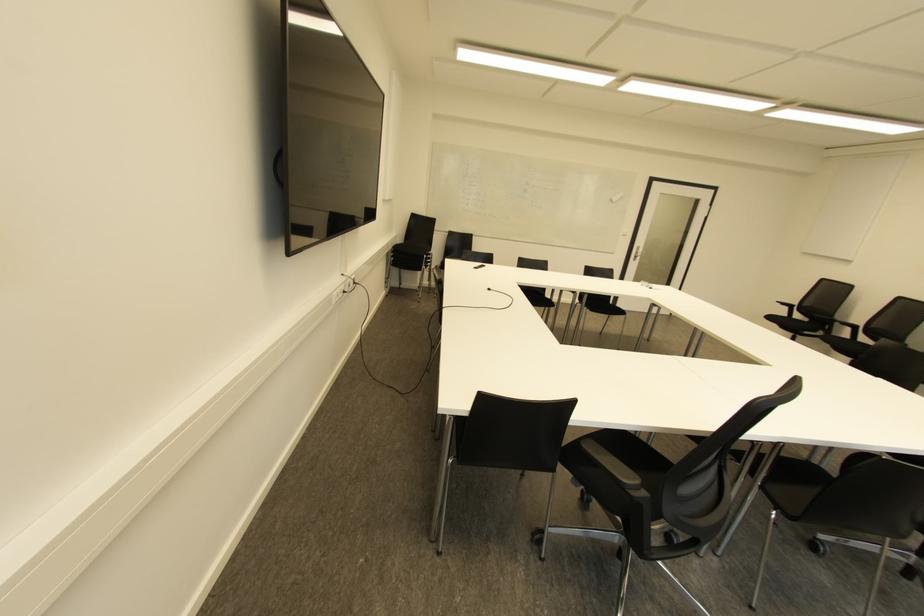
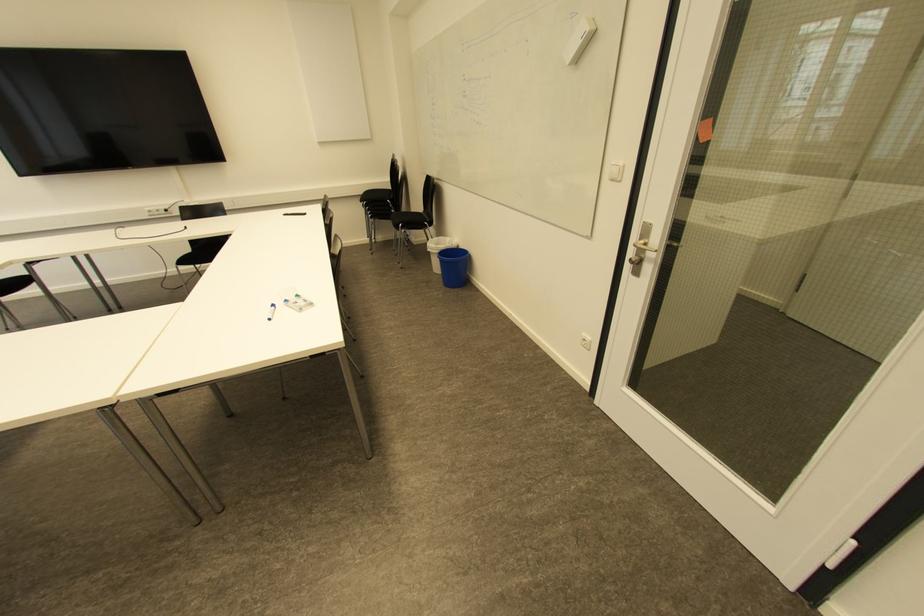
The point at (636, 257) is marked in the first image. Where is the corresponding point in the second image?

(638, 262)